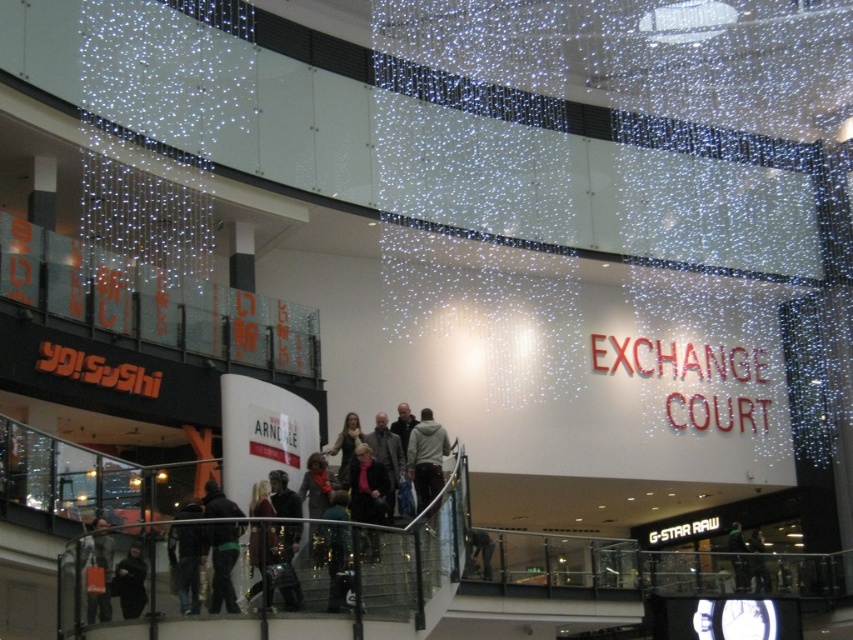
Who is positioned more to the right, dark brown leather jacket at center or dark gray fabric jacket at lower left?

dark brown leather jacket at center is more to the right.

Is point (357, 496) less distant than point (91, 604)?

No, it is not.

Find the location of a particular element. This screenshot has height=640, width=853. dark brown leather jacket at center is located at coordinates pyautogui.click(x=367, y=486).

Does light gray hoodie at center come behind green fabric jacket at center?

No, light gray hoodie at center is closer to the viewer.

Is light gray hoodie at center below green fabric jacket at center?

Actually, light gray hoodie at center is above green fabric jacket at center.

Which is behind, point (450, 445) or point (738, 548)?

The point (738, 548) is behind.

Identify the location of light gray hoodie at center. Image resolution: width=853 pixels, height=640 pixels. (426, 458).

Who is more forward, [335,593] or [109,564]?

Positioned in front is point [109,564].

Between dark blue jeans at lower center and dark gray fabric jacket at lower left, which one has more height?

With more height is dark blue jeans at lower center.

Is point (347, 572) positioned after point (107, 536)?

Yes, point (347, 572) is behind point (107, 536).

Image resolution: width=853 pixels, height=640 pixels. Identify the location of dark blue jeans at lower center. (334, 561).